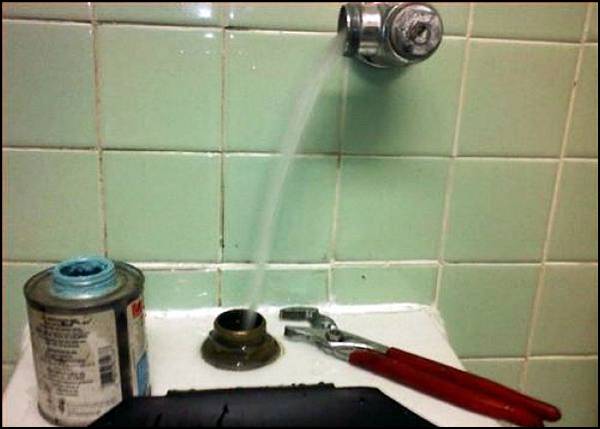
At what (x,y) coordinates should I click in order to perform the action: click on sink. Please return your answer as a coordinate pair (x, y). The image size is (600, 429). Looking at the image, I should click on click(424, 332).